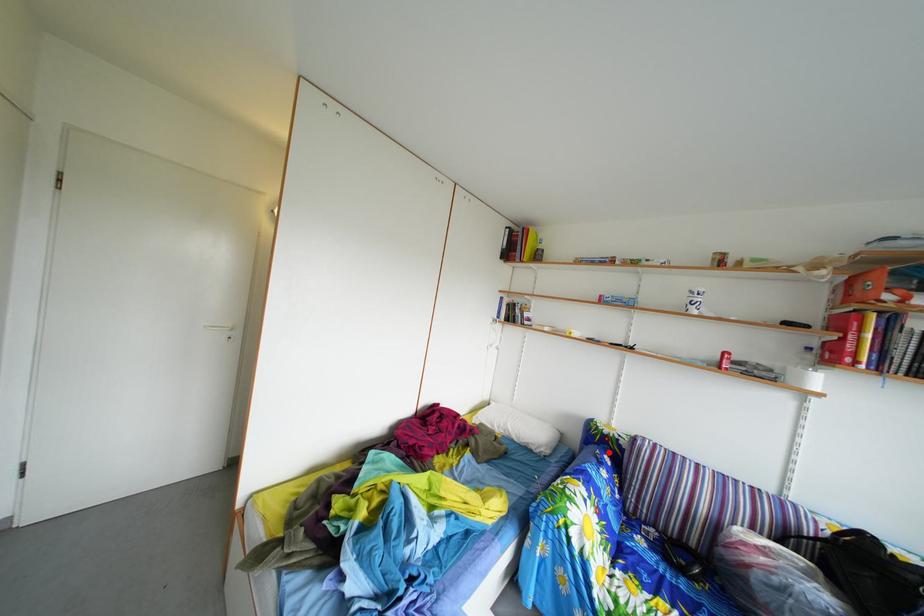
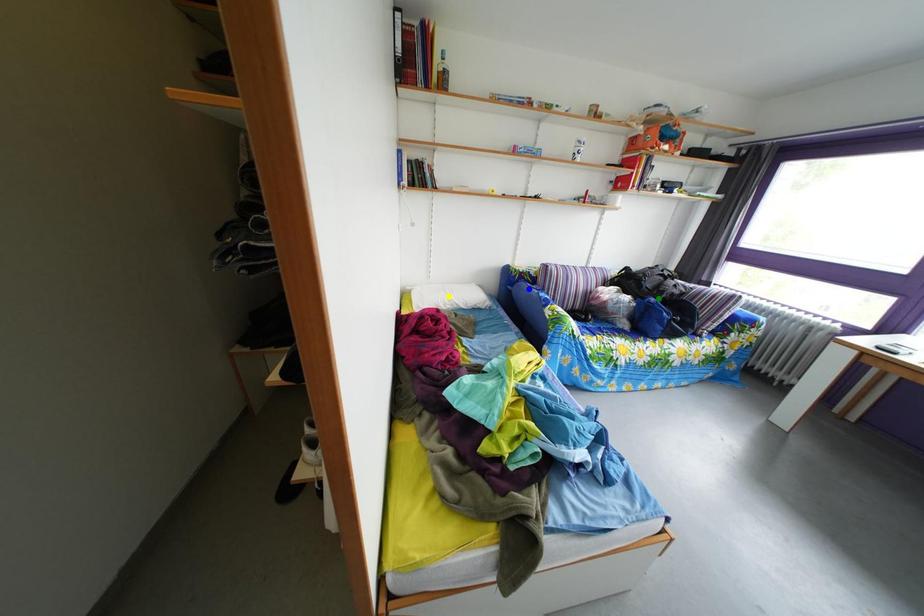
Question: I am providing you with two images of the same scene from different viewpoints. A red point is marked on the first image. You are given multiple points on the second image. Which spot in image 2 lines up with the point in image 1?

Choices:
 (A) blue point
 (B) green point
 (C) yellow point

Answer: (A)